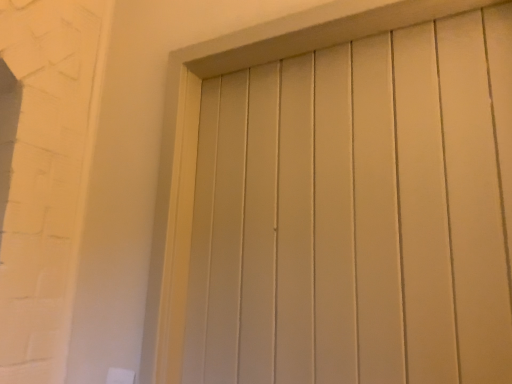
Describe the element at coordinates (196, 137) in the screenshot. I see `white painted wood door at center` at that location.

Locate an element on the screen. This screenshot has width=512, height=384. white painted wood door at center is located at coordinates (196, 137).

At what (x,y) coordinates should I click in order to perform the action: click on white painted wood door at center. Please return your answer as a coordinate pair (x, y). The height and width of the screenshot is (384, 512). Looking at the image, I should click on (196, 137).